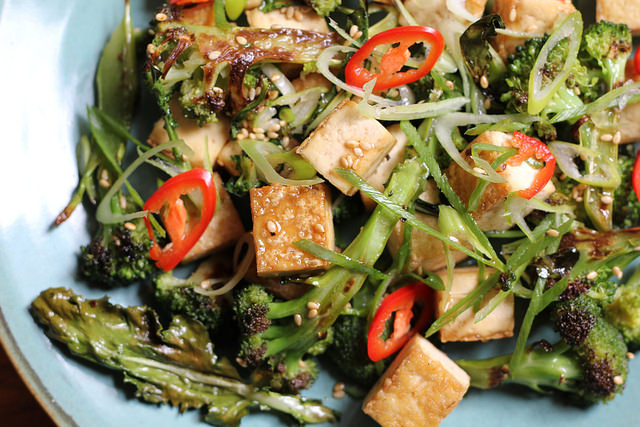
Identify the location of brown rim of plate. (52, 412).